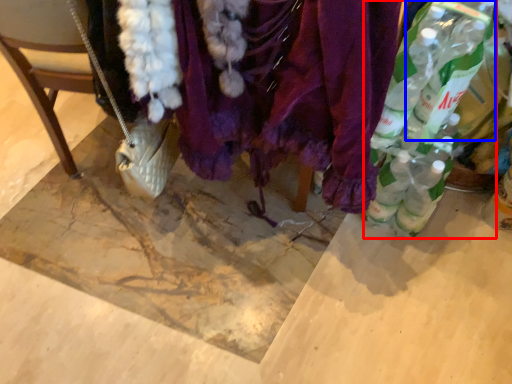
Question: Which object appears closest to the camera in this image, bottle (highlighted by a red box) or bottle (highlighted by a blue box)?

Choices:
 (A) bottle
 (B) bottle

Answer: (A)